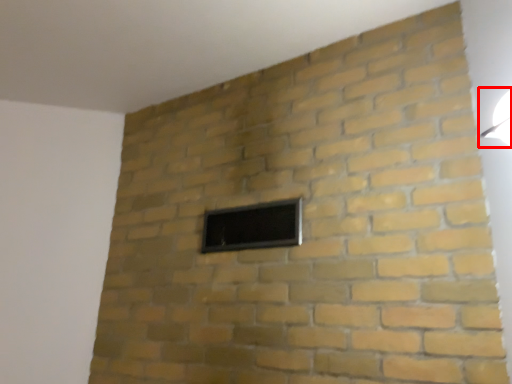
Question: In this image, where is light fixture (annotated by the red box) located relative to window?

Choices:
 (A) right
 (B) left

Answer: (A)